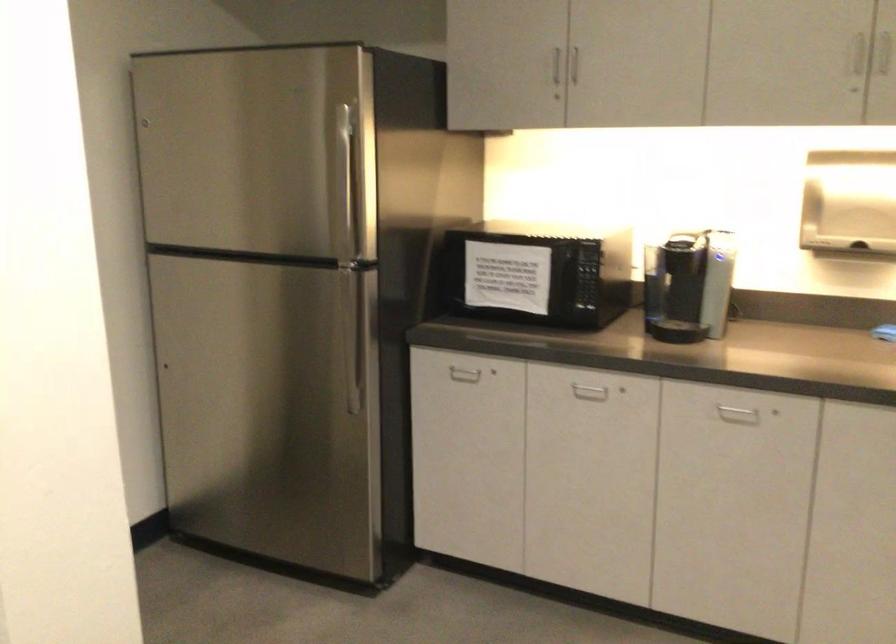
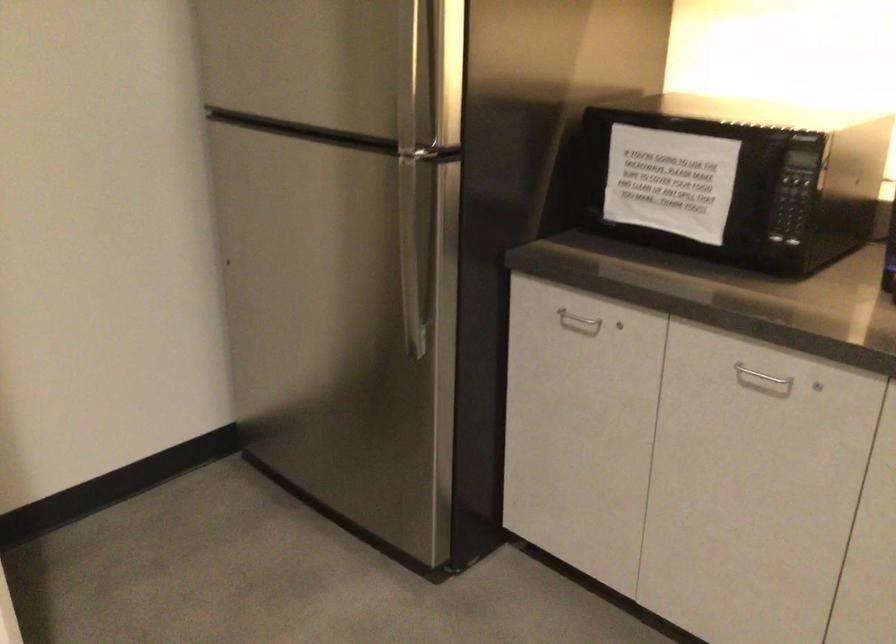
Question: In a continuous first-person perspective shot, in which direction is the camera moving?

Choices:
 (A) Left
 (B) Right
 (C) Forward
 (D) Backward

Answer: (C)